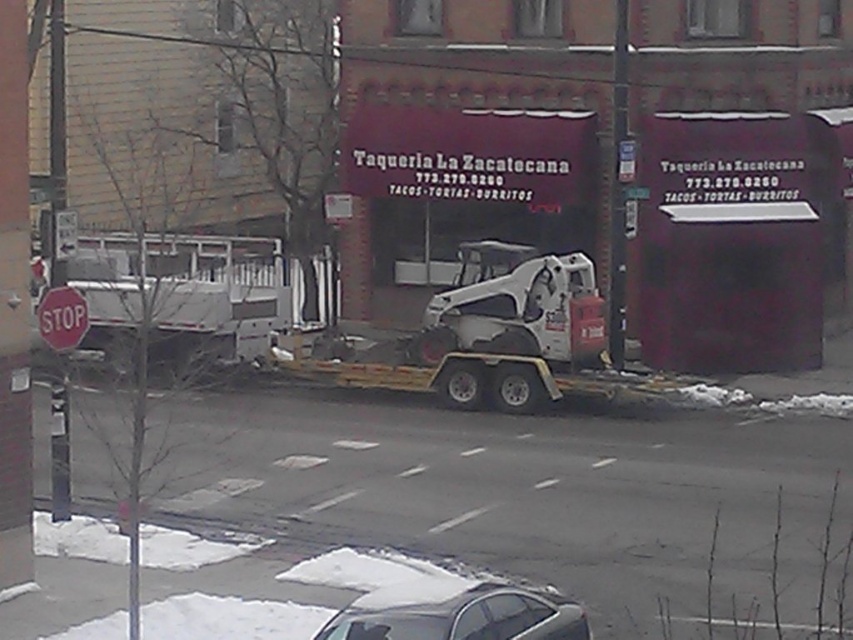
You are a delivery driver who needs to park your vehicle between the white matte trailer truck at left and the white matte skid steer loader at center. Given that your vehicle is smaller than the trailer truck but larger than the skid steer loader, where should you park?

Since the white matte trailer truck at left is larger than the white matte skid steer loader at center, you should park your vehicle between them, positioning it closer to the skid steer loader to ensure there is enough space between your vehicle and the larger trailer truck.

Looking at this image, you are a delivery driver who needs to park your 1.8 meter wide van between the silver metallic car at lower center and the red matte stop sign at lower left. Can you fit your van there?

The silver metallic car at lower center might be wider than the red matte stop sign at lower left, so there may not be enough space for your 1.8 meter wide van between them. You should check the actual width before attempting to park.